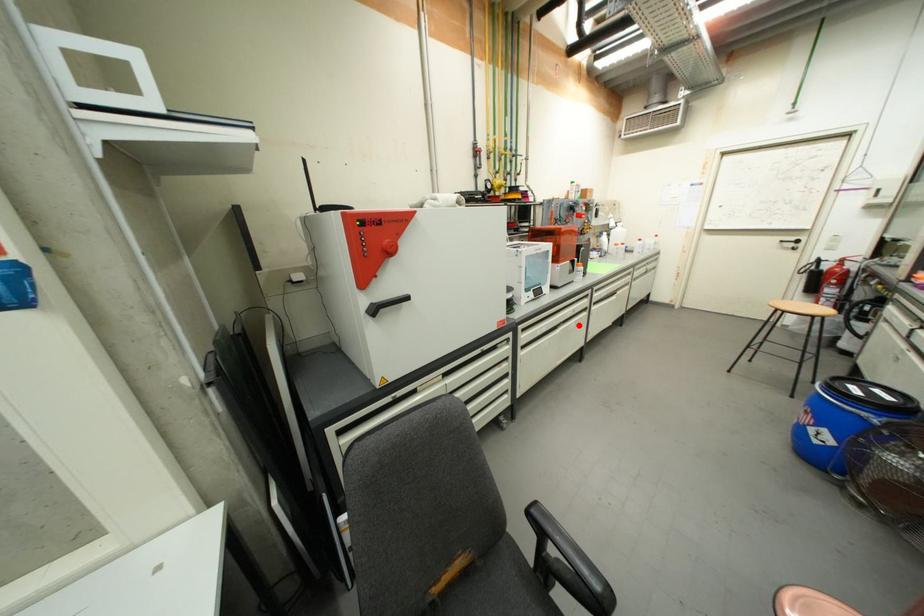
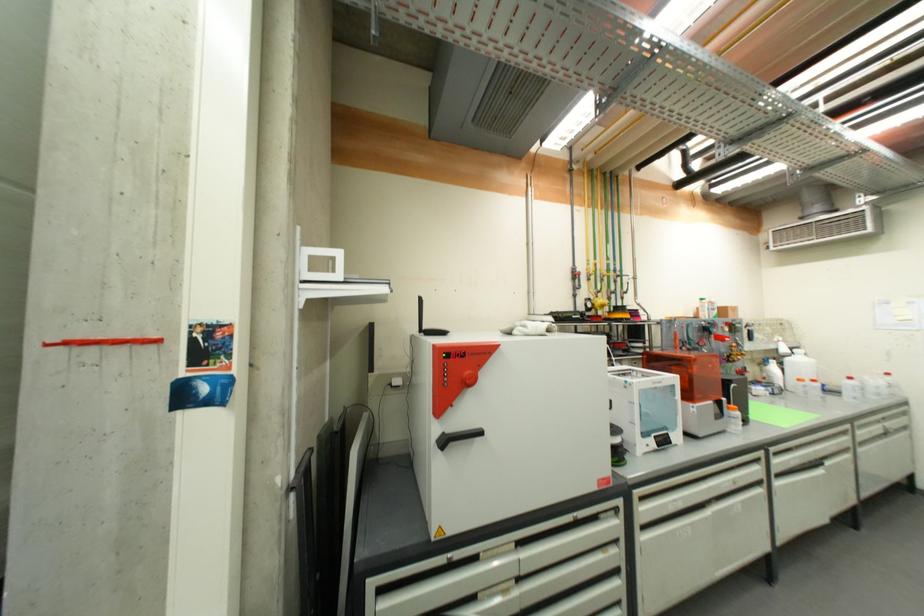
In the second image, find the point that corresponds to the highlighted location in the first image.

(745, 507)